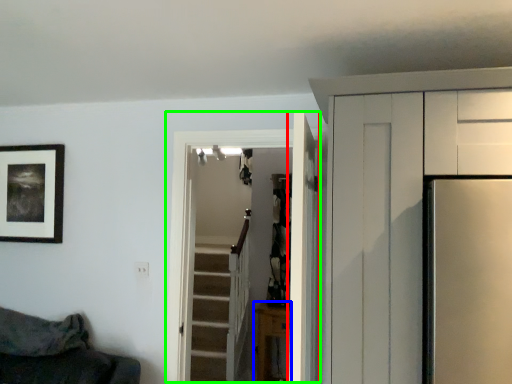
Question: Which object is positioned farthest from door (highlighted by a red box)? Select from furniture (highlighted by a blue box) and door (highlighted by a green box).

Choices:
 (A) furniture
 (B) door

Answer: (A)